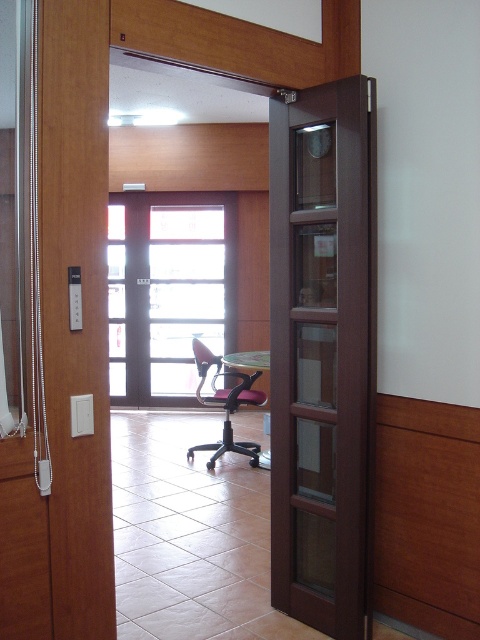
You are moving a pink fabric chair at center into a room through a dark wood screen door at right. Will the chair fit through the door?

The dark wood screen door at right is narrower than the pink fabric chair at center, so the chair will not fit through the door.